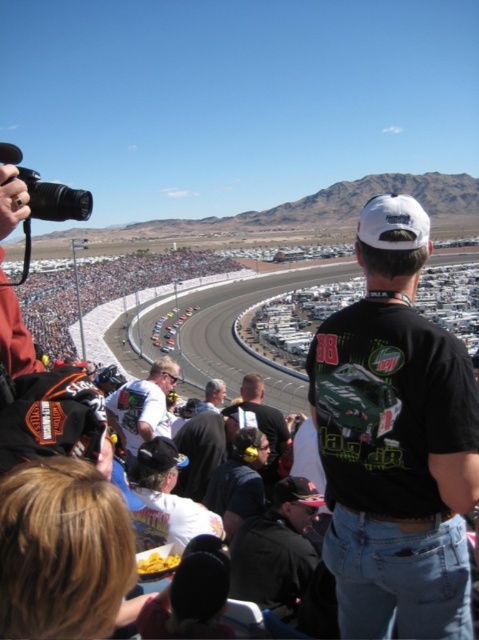
Question: Which point is closer to the camera?

Choices:
 (A) matte black race car at center
 (B) black leather jacket at lower center
 (C) matte black helmet at center

Answer: (B)

Question: Considering the real-world distances, which object is closest to the black leather jacket at lower center?

Choices:
 (A) black plastic camera at upper left
 (B) matte black helmet at center
 (C) white matte shirt at center
 (D) matte black race car at center

Answer: (C)

Question: Where is matte black race car at center located in relation to matte black helmet at center in the image?

Choices:
 (A) below
 (B) above

Answer: (B)

Question: Is matte black race car at center closer to the viewer compared to white matte shirt at center?

Choices:
 (A) no
 (B) yes

Answer: (A)

Question: Which point appears farthest from the camera in this image?

Choices:
 (A) (234, 406)
 (B) (429, 544)
 (C) (259, 573)
 (D) (154, 352)

Answer: (D)

Question: Can you confirm if matte black race car at center is positioned above dark brown leather jacket at center?

Choices:
 (A) no
 (B) yes

Answer: (B)